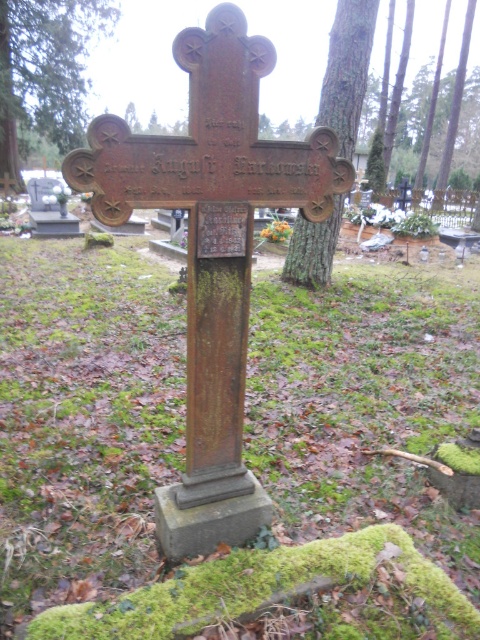
Question: Can you confirm if green mossy tree at upper left is smaller than green bark tree at upper center?

Choices:
 (A) no
 (B) yes

Answer: (A)

Question: Which is nearer to the green bark tree at upper center?

Choices:
 (A) smooth bark tree trunk at center
 (B) green mossy tree at upper left

Answer: (B)

Question: Is green mossy tree at upper left bigger than smooth bark tree trunk at center?

Choices:
 (A) yes
 (B) no

Answer: (A)

Question: Can you confirm if green mossy tree at upper left is positioned to the left of smooth bark tree trunk at center?

Choices:
 (A) yes
 (B) no

Answer: (A)

Question: Which point is closer to the camera taking this photo?

Choices:
 (A) (398, 83)
 (B) (55, 100)
 (C) (330, 36)

Answer: (C)

Question: Among these points, which one is nearest to the camera?

Choices:
 (A) (465, 70)
 (B) (289, 240)
 (C) (56, 26)

Answer: (B)